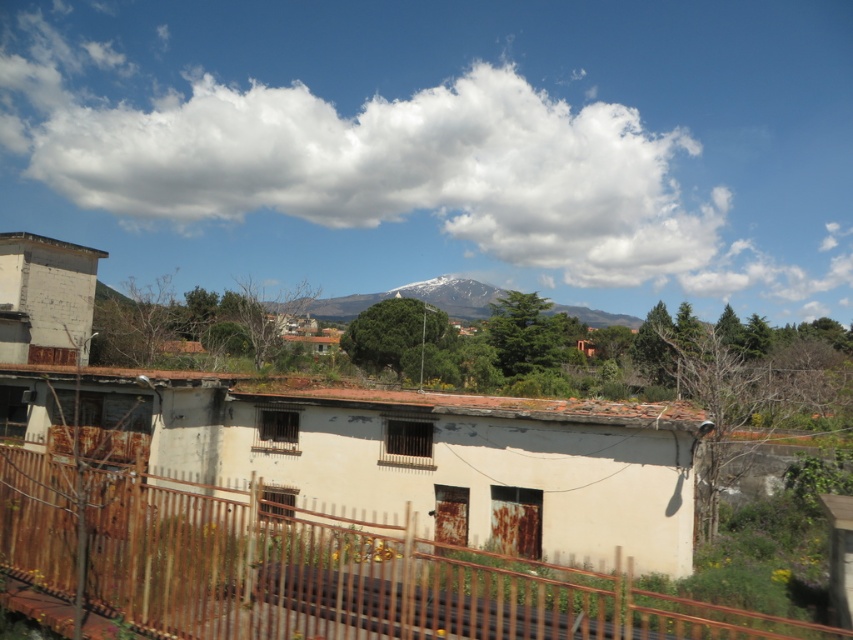
Question: Among these objects, which one is nearest to the camera?

Choices:
 (A) rusty metal fence at lower center
 (B) white fluffy cloud at upper center

Answer: (A)

Question: Which point appears closest to the camera in this image?

Choices:
 (A) pyautogui.click(x=15, y=189)
 (B) pyautogui.click(x=306, y=307)
 (C) pyautogui.click(x=567, y=628)

Answer: (C)

Question: Is rusty metal fence at lower center further to camera compared to snowy white mountain at center?

Choices:
 (A) no
 (B) yes

Answer: (A)

Question: Is white fluffy cloud at upper center wider than rusty metal fence at lower center?

Choices:
 (A) no
 (B) yes

Answer: (B)

Question: Which point is closer to the camera?

Choices:
 (A) snowy white mountain at center
 (B) white fluffy cloud at upper center
 (C) rusty metal fence at lower center

Answer: (C)

Question: Is white fluffy cloud at upper center smaller than rusty metal fence at lower center?

Choices:
 (A) no
 (B) yes

Answer: (A)